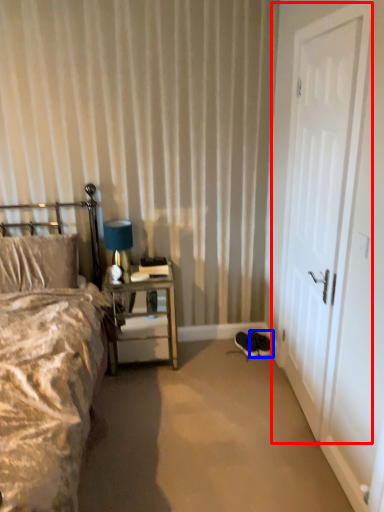
Question: Which object appears farthest to the camera in this image, door (highlighted by a red box) or footwear (highlighted by a blue box)?

Choices:
 (A) door
 (B) footwear

Answer: (B)